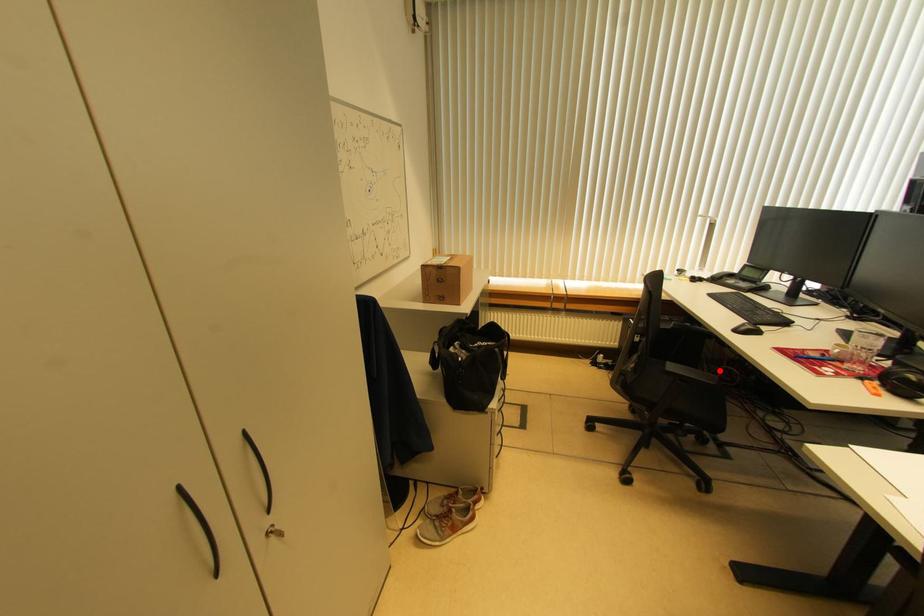
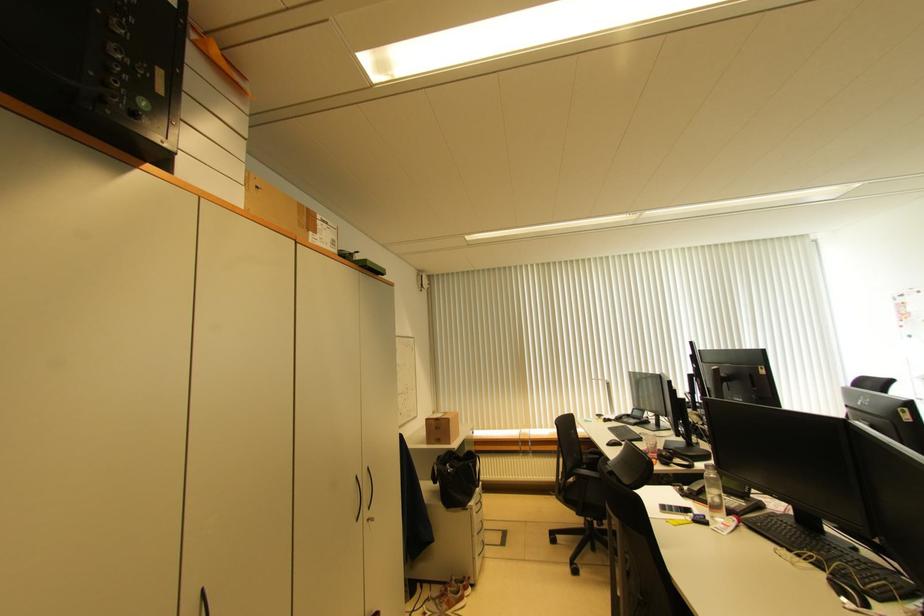
Question: I am providing you with two images of the same scene from different viewpoints. A red point is marked on the first image. Can you still see the location of the red point in image 2?

Choices:
 (A) Yes
 (B) No

Answer: (B)